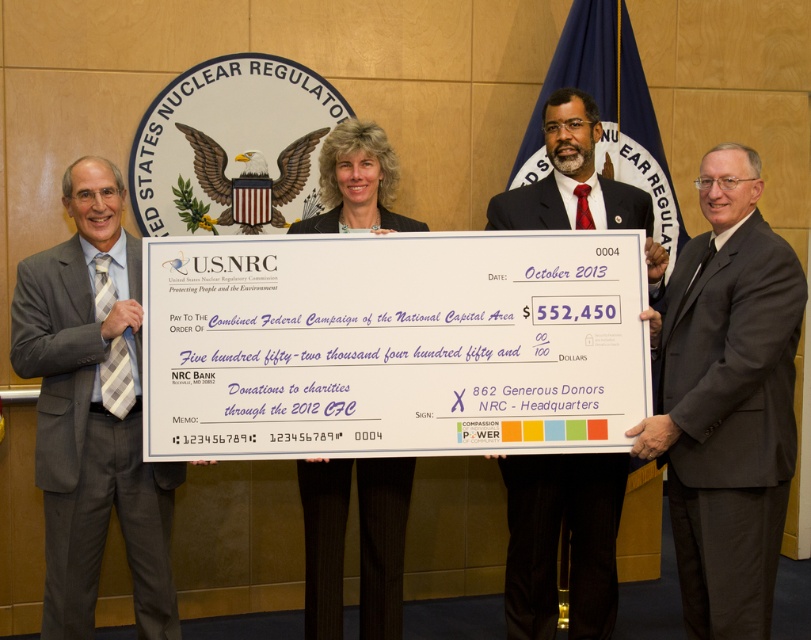
Locate an element on the screen. gray suit at left is located at coordinates (93, 412).

Who is shorter, gray suit at left or black pinstripe suit at center?

black pinstripe suit at center

What do you see at coordinates (93, 412) in the screenshot?
I see `gray suit at left` at bounding box center [93, 412].

Locate an element on the screen. gray suit at left is located at coordinates (93, 412).

The height and width of the screenshot is (640, 811). What do you see at coordinates (727, 401) in the screenshot?
I see `gray suit at right` at bounding box center [727, 401].

Who is positioned more to the right, gray suit at right or gray suit at left?

From the viewer's perspective, gray suit at right appears more on the right side.

The width and height of the screenshot is (811, 640). Describe the element at coordinates (727, 401) in the screenshot. I see `gray suit at right` at that location.

Where is `gray suit at right`? The image size is (811, 640). gray suit at right is located at coordinates (727, 401).

Can you confirm if dark suit at center is thinner than black pinstripe suit at center?

No, dark suit at center is not thinner than black pinstripe suit at center.

Can you confirm if dark suit at center is taller than black pinstripe suit at center?

Yes, dark suit at center is taller than black pinstripe suit at center.

Which is behind, point (608, 182) or point (357, 218)?

Point (608, 182)

Where is `dark suit at center`? dark suit at center is located at coordinates (556, 541).